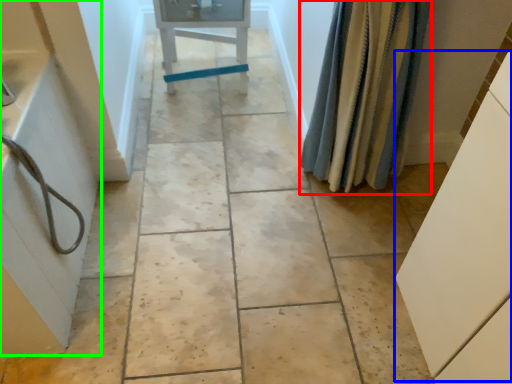
Question: Which object is positioned farthest from shower curtain (highlighted by a red box)? Select from cabinetry (highlighted by a blue box) and bath (highlighted by a green box).

Choices:
 (A) cabinetry
 (B) bath

Answer: (B)